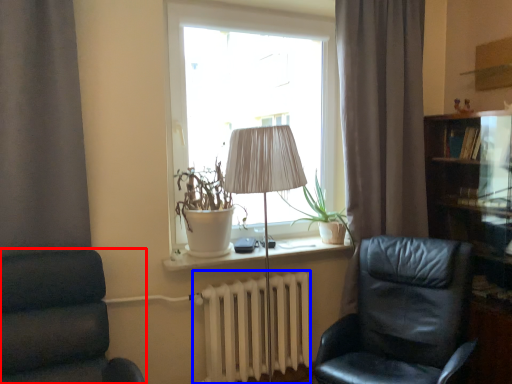
Question: Which of the following is the closest to the observer, chair (highlighted by a red box) or radiator (highlighted by a blue box)?

Choices:
 (A) chair
 (B) radiator

Answer: (A)